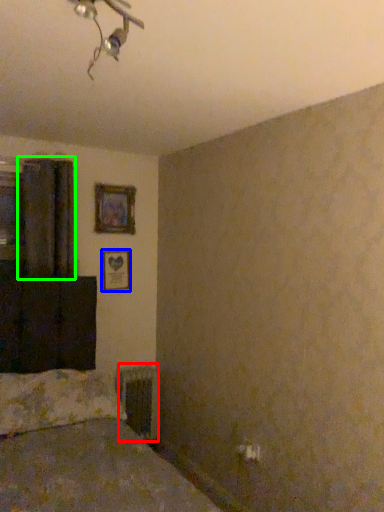
Question: Considering the real-world distances, which object is farthest from radiator (highlighted by a red box)? picture frame (highlighted by a blue box) or curtain (highlighted by a green box)?

Choices:
 (A) picture frame
 (B) curtain

Answer: (B)